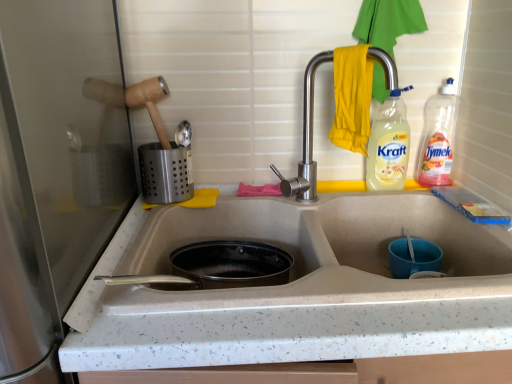
What is the approximate height of satin silver utensil holder at upper left, placed as the 2th appliance when sorted from bottom to top?

It is 5.58 inches.

Describe the element at coordinates (319, 252) in the screenshot. I see `white speckled stone sink at center` at that location.

How much space does clear plastic bottle at upper right, which ranks as the 1th bottle in right-to-left order, occupy horizontally?

4.11 inches.

Describe the element at coordinates (307, 140) in the screenshot. I see `satin nickel faucet at center` at that location.

Measure the distance between point (371, 68) and camera.

A distance of 32.20 inches exists between point (371, 68) and camera.

At what (x,y) coordinates should I click in order to perform the action: click on satin silver utensil holder at upper left, positioned as the first appliance in top-to-bottom order. Please return your answer as a coordinate pair (x, y). The image size is (512, 384). Looking at the image, I should click on (165, 173).

From the picture: From the image's perspective, which one is positioned higher, white speckled countertop at left, acting as the second appliance starting from the top, or satin nickel faucet at center?

From the image's view, satin nickel faucet at center is above.

Does white speckled countertop at left, the first appliance when ordered from bottom to top, appear on the right side of satin nickel faucet at center?

No, white speckled countertop at left, the first appliance when ordered from bottom to top, is not to the right of satin nickel faucet at center.

Considering the relative sizes of white speckled countertop at left, the first appliance from the left, and satin nickel faucet at center in the image provided, is white speckled countertop at left, the first appliance from the left, taller than satin nickel faucet at center?

Yes, white speckled countertop at left, the first appliance from the left, is taller than satin nickel faucet at center.

Is white speckled countertop at left, positioned as the 2th appliance in back-to-front order, positioned beyond the bounds of satin nickel faucet at center?

Absolutely, white speckled countertop at left, positioned as the 2th appliance in back-to-front order, is external to satin nickel faucet at center.

Between translucent plastic bottle at upper right, the second bottle in the right-to-left sequence, and satin silver utensil holder at upper left, positioned as the first appliance in top-to-bottom order, which one has larger size?

With larger size is satin silver utensil holder at upper left, positioned as the first appliance in top-to-bottom order.

Considering the sizes of objects translucent plastic bottle at upper right, the second bottle in the right-to-left sequence, and satin silver utensil holder at upper left, the first appliance in the back-to-front sequence, in the image provided, who is thinner, translucent plastic bottle at upper right, the second bottle in the right-to-left sequence, or satin silver utensil holder at upper left, the first appliance in the back-to-front sequence,?

translucent plastic bottle at upper right, the second bottle in the right-to-left sequence.

Between point (402, 187) and point (192, 196), which one is positioned behind?

Positioned behind is point (402, 187).

Is translucent plastic bottle at upper right, the second bottle in the right-to-left sequence, with satin silver utensil holder at upper left, which ranks as the 2th appliance in front-to-back order?

No, translucent plastic bottle at upper right, the second bottle in the right-to-left sequence, is not beside satin silver utensil holder at upper left, which ranks as the 2th appliance in front-to-back order.

Is satin nickel faucet at center facing away from yellow fabric hand towel at upper right?

Yes, satin nickel faucet at center is facing away from yellow fabric hand towel at upper right.

From the image's perspective, which one is positioned lower, satin nickel faucet at center or yellow fabric hand towel at upper right?

satin nickel faucet at center.

From the image's perspective, is satin silver utensil holder at upper left, the first appliance in the back-to-front sequence, on top of clear plastic bottle at upper right, which is the second bottle from left to right?

No, from the image's perspective, satin silver utensil holder at upper left, the first appliance in the back-to-front sequence, is not over clear plastic bottle at upper right, which is the second bottle from left to right.

From a real-world perspective, is satin silver utensil holder at upper left, the first appliance in the back-to-front sequence, beneath clear plastic bottle at upper right, which ranks as the 1th bottle in right-to-left order?

Correct, in the physical world, satin silver utensil holder at upper left, the first appliance in the back-to-front sequence, is lower than clear plastic bottle at upper right, which ranks as the 1th bottle in right-to-left order.

Considering the relative positions of satin silver utensil holder at upper left, positioned as the second appliance in left-to-right order, and clear plastic bottle at upper right, which is the second bottle from left to right, in the image provided, is satin silver utensil holder at upper left, positioned as the second appliance in left-to-right order, behind clear plastic bottle at upper right, which is the second bottle from left to right,?

No, it is in front of clear plastic bottle at upper right, which is the second bottle from left to right.

This screenshot has width=512, height=384. Find the location of `appliance that is the 1st one when counting leftward from the clear plastic bottle at upper right, which ranks as the 1th bottle in right-to-left order`. appliance that is the 1st one when counting leftward from the clear plastic bottle at upper right, which ranks as the 1th bottle in right-to-left order is located at coordinates (165, 173).

Find the location of `sink lying below the satin nickel faucet at center (from the image's perspective)`. sink lying below the satin nickel faucet at center (from the image's perspective) is located at coordinates (319, 252).

Is satin nickel faucet at center located within white speckled stone sink at center?

No, satin nickel faucet at center is not inside white speckled stone sink at center.

From a real-world perspective, which object rests below the other?

white speckled stone sink at center is physically lower.

Is white speckled stone sink at center facing towards satin nickel faucet at center?

No, white speckled stone sink at center is not turned towards satin nickel faucet at center.

Is satin nickel faucet at center with satin silver utensil holder at upper left, the first appliance in the back-to-front sequence?

satin nickel faucet at center and satin silver utensil holder at upper left, the first appliance in the back-to-front sequence, are clearly separated.

How different are the orientations of satin nickel faucet at center and satin silver utensil holder at upper left, positioned as the second appliance in left-to-right order, in degrees?

6.25e-05 degrees separate the facing orientations of satin nickel faucet at center and satin silver utensil holder at upper left, positioned as the second appliance in left-to-right order.

Identify the location of the 1st appliance positioned below the satin nickel faucet at center (from a real-world perspective). This screenshot has height=384, width=512. (165, 173).

Considering the sizes of objects satin nickel faucet at center and satin silver utensil holder at upper left, arranged as the first appliance when viewed from the right, in the image provided, who is bigger, satin nickel faucet at center or satin silver utensil holder at upper left, arranged as the first appliance when viewed from the right,?

satin nickel faucet at center is bigger.

Is satin silver utensil holder at upper left, positioned as the second appliance in left-to-right order, touching yellow fabric hand towel at upper right?

No, satin silver utensil holder at upper left, positioned as the second appliance in left-to-right order, is not next to yellow fabric hand towel at upper right.

Can we say satin silver utensil holder at upper left, which ranks as the 2th appliance in front-to-back order, lies outside yellow fabric hand towel at upper right?

Absolutely, satin silver utensil holder at upper left, which ranks as the 2th appliance in front-to-back order, is external to yellow fabric hand towel at upper right.

Is satin silver utensil holder at upper left, the first appliance in the back-to-front sequence, facing towards yellow fabric hand towel at upper right?

No.

Locate an element on the screen. appliance in front of the satin nickel faucet at center is located at coordinates (55, 171).

Which bottle is the 1st one when counting from the back of the satin silver utensil holder at upper left, positioned as the first appliance in top-to-bottom order? Please provide its 2D coordinates.

[(388, 145)]

Looking at this image, when comparing their distances from white speckled stone sink at center, does satin silver utensil holder at upper left, positioned as the first appliance in top-to-bottom order, or satin nickel faucet at center seem further?

Based on the image, satin silver utensil holder at upper left, positioned as the first appliance in top-to-bottom order, appears to be further to white speckled stone sink at center.

Which object lies further to the anchor point white speckled countertop at left, the first appliance when ordered from bottom to top, satin nickel faucet at center or white speckled stone sink at center?

satin nickel faucet at center.

Based on their spatial positions, is white speckled countertop at left, the first appliance when ordered from front to back, or translucent plastic bottle at upper right, the second bottle in the right-to-left sequence, closer to satin silver utensil holder at upper left, positioned as the second appliance in left-to-right order?

white speckled countertop at left, the first appliance when ordered from front to back, lies closer to satin silver utensil holder at upper left, positioned as the second appliance in left-to-right order, than the other object.

Looking at the image, which one is located closer to white speckled countertop at left, acting as the second appliance starting from the top, yellow fabric hand towel at upper right or white speckled stone sink at center?

white speckled stone sink at center lies closer to white speckled countertop at left, acting as the second appliance starting from the top, than the other object.

From the image, which object appears to be nearer to satin silver utensil holder at upper left, the first appliance in the back-to-front sequence, yellow fabric hand towel at upper right or satin nickel faucet at center?

The object closer to satin silver utensil holder at upper left, the first appliance in the back-to-front sequence, is satin nickel faucet at center.

In the scene shown: When comparing their distances from satin nickel faucet at center, does satin silver utensil holder at upper left, placed as the 2th appliance when sorted from bottom to top, or translucent plastic bottle at upper right, the second bottle in the right-to-left sequence, seem further?

satin silver utensil holder at upper left, placed as the 2th appliance when sorted from bottom to top, is positioned further to the anchor satin nickel faucet at center.

Looking at the image, which one is located closer to yellow fabric hand towel at upper right, satin silver utensil holder at upper left, arranged as the first appliance when viewed from the right, or clear plastic bottle at upper right, which ranks as the 1th bottle in right-to-left order?

clear plastic bottle at upper right, which ranks as the 1th bottle in right-to-left order, is positioned closer to the anchor yellow fabric hand towel at upper right.

From the image, which object appears to be nearer to satin silver utensil holder at upper left, positioned as the second appliance in left-to-right order, clear plastic bottle at upper right, which ranks as the 1th bottle in right-to-left order, or white speckled countertop at left, the first appliance when ordered from bottom to top?

white speckled countertop at left, the first appliance when ordered from bottom to top, is closer to satin silver utensil holder at upper left, positioned as the second appliance in left-to-right order.

Find the location of a particular element. The image size is (512, 384). hand towel between satin nickel faucet at center and translucent plastic bottle at upper right, which is the 1th bottle from left to right, from front to back is located at coordinates (352, 98).

Identify the location of hand towel situated between satin silver utensil holder at upper left, the first appliance in the back-to-front sequence, and translucent plastic bottle at upper right, the second bottle in the right-to-left sequence, from left to right. (352, 98).

This screenshot has height=384, width=512. I want to click on hand towel between satin nickel faucet at center and clear plastic bottle at upper right, which ranks as the 1th bottle in right-to-left order, in the horizontal direction, so click(x=352, y=98).

The image size is (512, 384). Identify the location of hand towel situated between white speckled countertop at left, positioned as the 2th appliance in back-to-front order, and translucent plastic bottle at upper right, which is the 1th bottle from left to right, from left to right. (352, 98).